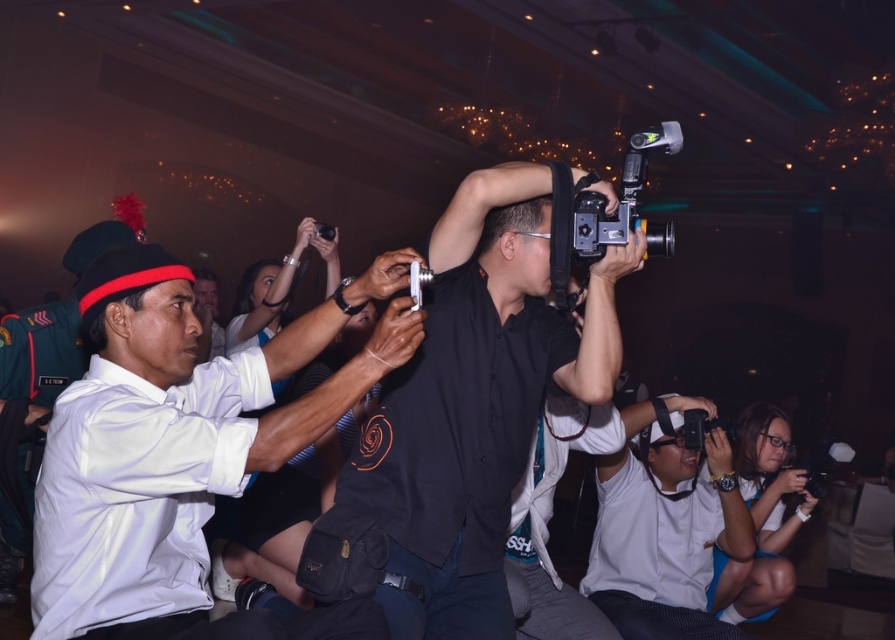
Question: Which object is closer to the camera taking this photo?

Choices:
 (A) white matte uniform at center
 (B) black matte camera at center

Answer: (A)

Question: Can you confirm if white matte shirt at center is wider than black plastic video camera at upper center?

Choices:
 (A) no
 (B) yes

Answer: (B)

Question: Does white matte uniform at center come behind black plastic video camera at upper center?

Choices:
 (A) no
 (B) yes

Answer: (A)

Question: Which of the following is the farthest from the observer?

Choices:
 (A) white matte shirt at center
 (B) white matte uniform at center

Answer: (A)

Question: From the image, what is the correct spatial relationship of white matte shirt at center in relation to black plastic video camera at upper center?

Choices:
 (A) above
 (B) below

Answer: (B)

Question: Which point appears closest to the camera in this image?

Choices:
 (A) (118, 580)
 (B) (671, 228)
 (C) (550, 228)
 (D) (644, 580)

Answer: (A)